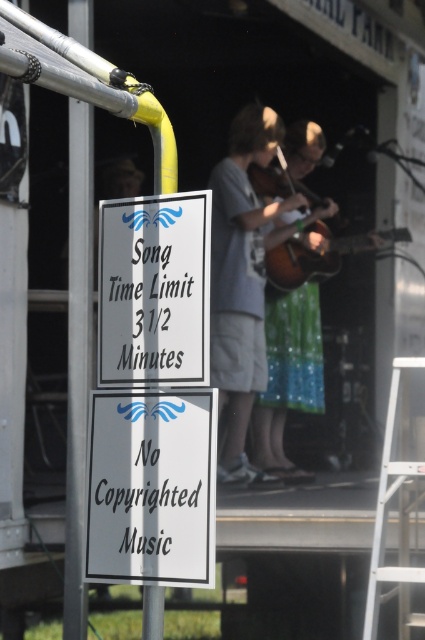
Question: Does white paper sign at center appear under brown wooden guitar at center?

Choices:
 (A) yes
 (B) no

Answer: (A)

Question: Which point is farther from the camera taking this photo?

Choices:
 (A) (210, 445)
 (B) (193, 298)
 (C) (249, 186)

Answer: (C)

Question: Can you confirm if white paper sign at lower center is thinner than white paper sign at center?

Choices:
 (A) yes
 (B) no

Answer: (B)

Question: Among these points, which one is farthest from the camera?

Choices:
 (A) (90, 561)
 (B) (303, 273)

Answer: (B)

Question: Is gray cotton shirt at upper center bigger than brown wooden guitar at center?

Choices:
 (A) no
 (B) yes

Answer: (B)

Question: Which object appears closest to the camera in this image?

Choices:
 (A) white paper sign at lower center
 (B) white paper sign at center
 (C) brown wooden guitar at center
 (D) gray cotton shirt at upper center

Answer: (B)